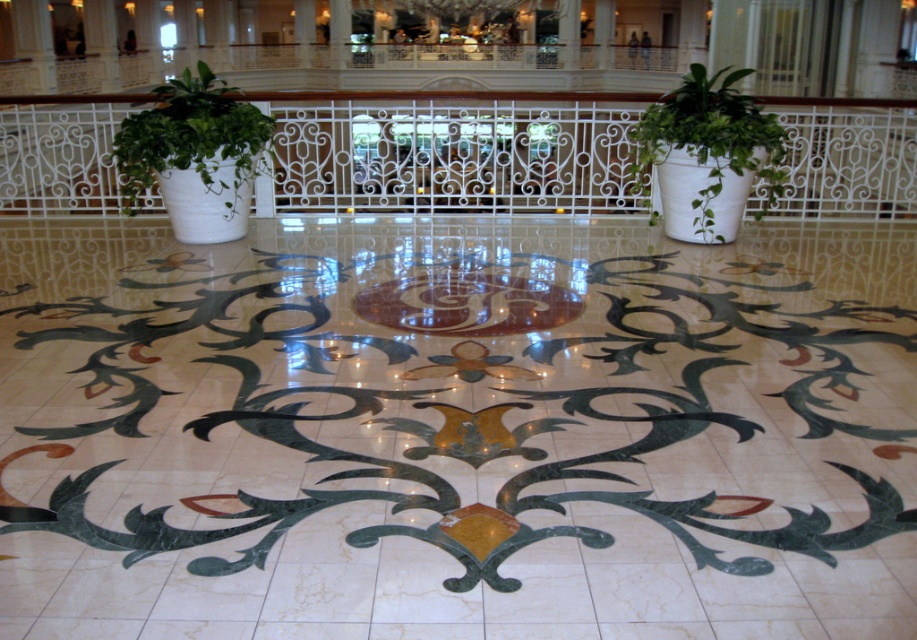
Question: Is white wrought iron at center smaller than green matte plant at center?

Choices:
 (A) yes
 (B) no

Answer: (A)

Question: Which of the following is the closest to the observer?

Choices:
 (A) green leafy plant at left
 (B) white wrought iron at center
 (C) green matte plant at center

Answer: (C)

Question: Which object is closer to the camera taking this photo?

Choices:
 (A) green leafy plant at left
 (B) green matte plant at center

Answer: (B)

Question: Which object is positioned closest to the green matte plant at center?

Choices:
 (A) green leafy plant at left
 (B) white wrought iron at center

Answer: (B)

Question: Can you confirm if white wrought iron at center is smaller than green leafy plant at left?

Choices:
 (A) no
 (B) yes

Answer: (A)

Question: Is white wrought iron at center bigger than green leafy plant at left?

Choices:
 (A) no
 (B) yes

Answer: (B)